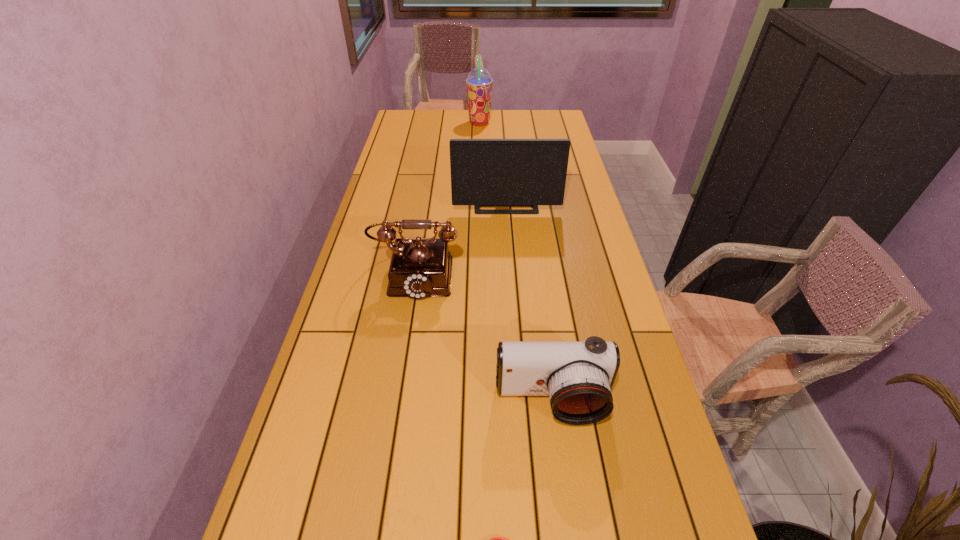
Identify the location of empty space between the second farthest object and the camcorder. (529, 303).

In order to click on empty space between the smoothie and the third nearest object in this screenshot , I will do (x=447, y=198).

Find the location of a particular element. The image size is (960, 540). vacant space that is in between the second farthest object and the third nearest object is located at coordinates (461, 239).

Where is `object that is the third nearest to the tennis racket`? The image size is (960, 540). object that is the third nearest to the tennis racket is located at coordinates point(484,172).

Locate which object ranks fourth in proximity to the camcorder. Please provide its 2D coordinates. Your answer should be formatted as a tuple, i.e. [(x, y)], where the tuple contains the x and y coordinates of a point satisfying the conditions above.

[(479, 82)]